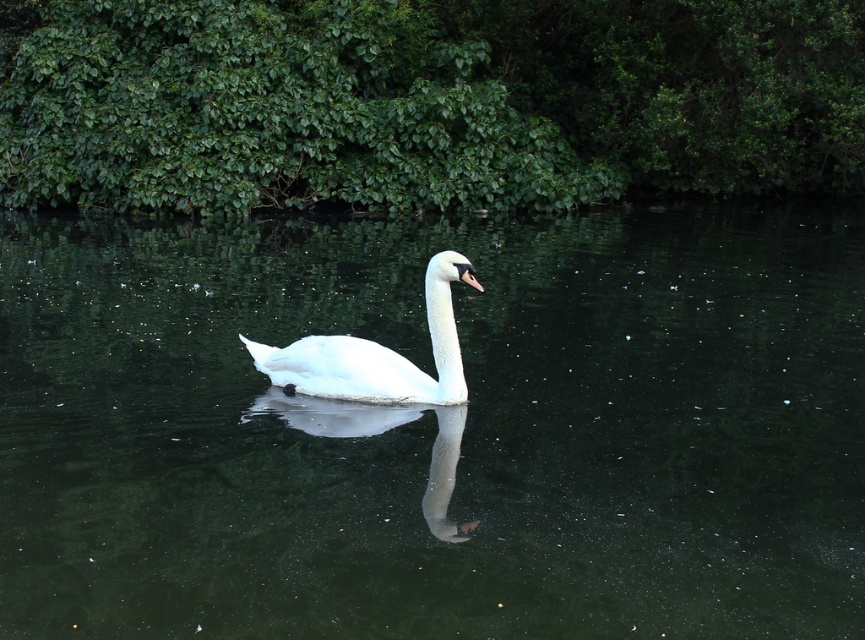
Question: Can you confirm if clear dark water at center is positioned to the right of white glossy swan at center?

Choices:
 (A) yes
 (B) no

Answer: (A)

Question: Does clear dark water at center have a greater width compared to white glossy swan at center?

Choices:
 (A) yes
 (B) no

Answer: (A)

Question: Which object appears closest to the camera in this image?

Choices:
 (A) clear dark water at center
 (B) white glossy swan at center

Answer: (A)

Question: Is clear dark water at center thinner than white glossy swan at center?

Choices:
 (A) yes
 (B) no

Answer: (B)